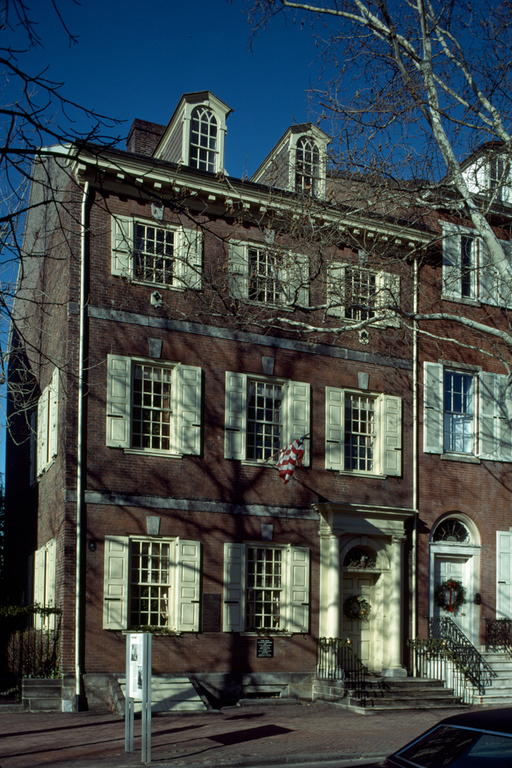
The image size is (512, 768). Identify the location of wreath. (359, 611), (450, 588).